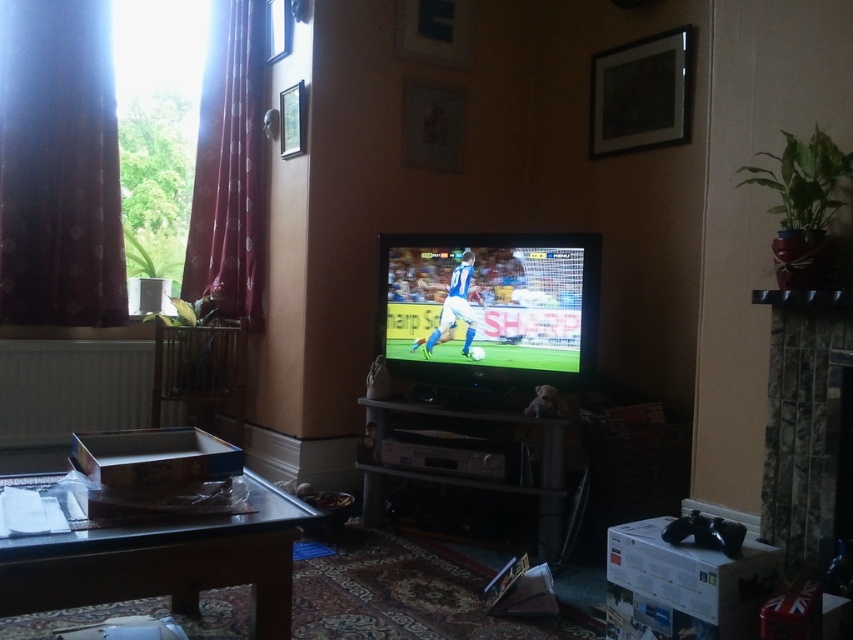
The width and height of the screenshot is (853, 640). What do you see at coordinates (59, 166) in the screenshot?
I see `dark red velvet curtain at left` at bounding box center [59, 166].

Which is more to the left, dark red velvet curtain at left or clear glass window at upper center?

From the viewer's perspective, dark red velvet curtain at left appears more on the left side.

Which is in front, point (67, 64) or point (265, 60)?

Positioned in front is point (67, 64).

Locate an element on the screen. The image size is (853, 640). dark red velvet curtain at left is located at coordinates (59, 166).

Does marble fireplace at right have a smaller size compared to clear glass window at upper center?

No, marble fireplace at right is not smaller than clear glass window at upper center.

Is point (782, 330) positioned in front of point (288, 52)?

Yes, point (782, 330) is closer to viewer.

Identify the location of marble fireplace at right. (x=807, y=426).

Does point (204, 188) come closer to viewer compared to point (489, 440)?

No.

Is point (210, 244) positioned behind point (503, 436)?

Yes, point (210, 244) is farther from viewer.

Identify the location of velvet red curtain at left. (229, 170).

I want to click on velvet red curtain at left, so click(229, 170).